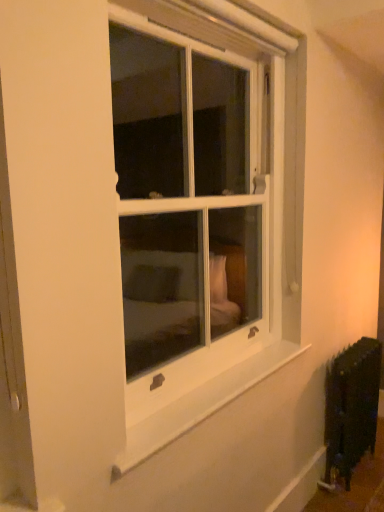
This screenshot has width=384, height=512. Describe the element at coordinates (202, 204) in the screenshot. I see `white glass window at center` at that location.

Measure the distance between white glass window at center and camera.

white glass window at center and camera are 2.09 meters apart.

The height and width of the screenshot is (512, 384). In order to click on white smooth window sill at lower center in this screenshot , I will do `click(200, 404)`.

The image size is (384, 512). What do you see at coordinates (200, 404) in the screenshot?
I see `white smooth window sill at lower center` at bounding box center [200, 404].

Image resolution: width=384 pixels, height=512 pixels. Find the location of `black matte radiator at lower right`. black matte radiator at lower right is located at coordinates (351, 408).

Where is `white glass window at center`? The width and height of the screenshot is (384, 512). white glass window at center is located at coordinates (202, 204).

From a real-world perspective, who is located higher, white smooth window sill at lower center or white glass window at center?

From a 3D spatial view, white glass window at center is above.

How much distance is there between white smooth window sill at lower center and white glass window at center?

4.78 feet.

Is white smooth window sill at lower center not close to white glass window at center?

white smooth window sill at lower center is positioned a significant distance from white glass window at center.

Are black matte radiator at lower right and white glass window at center making contact?

No, black matte radiator at lower right is not making contact with white glass window at center.

Which object is positioned more to the right, black matte radiator at lower right or white glass window at center?

Positioned to the right is black matte radiator at lower right.

Consider the image. Is black matte radiator at lower right thinner than white glass window at center?

Yes.

How distant is black matte radiator at lower right from white glass window at center?

A distance of 1.29 meters exists between black matte radiator at lower right and white glass window at center.

Considering the relative sizes of white smooth window sill at lower center and black matte radiator at lower right in the image provided, is white smooth window sill at lower center smaller than black matte radiator at lower right?

Yes, white smooth window sill at lower center is smaller than black matte radiator at lower right.

From the image's perspective, is white smooth window sill at lower center above or below black matte radiator at lower right?

From the image's perspective, white smooth window sill at lower center appears above black matte radiator at lower right.

Is white smooth window sill at lower center shorter than black matte radiator at lower right?

Yes.

Which object is positioned more to the left, white smooth window sill at lower center or black matte radiator at lower right?

white smooth window sill at lower center is more to the left.

In the scene shown: How distant is white glass window at center from white smooth window sill at lower center?

They are 4.78 feet apart.

Is white glass window at center wider or thinner than white smooth window sill at lower center?

Considering their sizes, white glass window at center looks broader than white smooth window sill at lower center.

Does white glass window at center turn towards white smooth window sill at lower center?

No, white glass window at center is not aimed at white smooth window sill at lower center.

From the image's perspective, which one is positioned lower, white glass window at center or white smooth window sill at lower center?

white smooth window sill at lower center is shown below in the image.

From the picture: Considering the sizes of objects white glass window at center and black matte radiator at lower right in the image provided, who is thinner, white glass window at center or black matte radiator at lower right?

Thinner between the two is black matte radiator at lower right.

Is white glass window at center positioned behind black matte radiator at lower right?

No, the depth of white glass window at center is less than that of black matte radiator at lower right.

Between black matte radiator at lower right and white smooth window sill at lower center, which one has smaller width?

With smaller width is white smooth window sill at lower center.

Which is closer, (x=345, y=448) or (x=215, y=381)?

Point (x=215, y=381)

How different are the orientations of black matte radiator at lower right and white smooth window sill at lower center in degrees?

The facing directions of black matte radiator at lower right and white smooth window sill at lower center are 0.627 degrees apart.

From the image's perspective, is black matte radiator at lower right located above white smooth window sill at lower center?

No, from the image's perspective, black matte radiator at lower right is not above white smooth window sill at lower center.

The height and width of the screenshot is (512, 384). What are the coordinates of `window above the white smooth window sill at lower center (from a real-world perspective)` in the screenshot? It's located at (202, 204).

Locate an element on the screen. This screenshot has height=512, width=384. window lying in front of the black matte radiator at lower right is located at coordinates (202, 204).

Considering their positions, is white glass window at center positioned closer to white smooth window sill at lower center than black matte radiator at lower right?

Among the two, black matte radiator at lower right is located nearer to white smooth window sill at lower center.

Looking at the image, which one is located further to white glass window at center, white smooth window sill at lower center or black matte radiator at lower right?

white smooth window sill at lower center lies further to white glass window at center than the other object.

Estimate the real-world distances between objects in this image. Which object is further from white glass window at center, black matte radiator at lower right or white smooth window sill at lower center?

white smooth window sill at lower center.

From the image, which object appears to be nearer to white smooth window sill at lower center, black matte radiator at lower right or white glass window at center?

black matte radiator at lower right.

Looking at this image, from the image, which object appears to be nearer to black matte radiator at lower right, white glass window at center or white smooth window sill at lower center?

Based on the image, white smooth window sill at lower center appears to be nearer to black matte radiator at lower right.

Looking at the image, which one is located closer to black matte radiator at lower right, white smooth window sill at lower center or white glass window at center?

white smooth window sill at lower center.

What are the coordinates of `window sill between white glass window at center and black matte radiator at lower right in the front-back direction` in the screenshot? It's located at (200, 404).